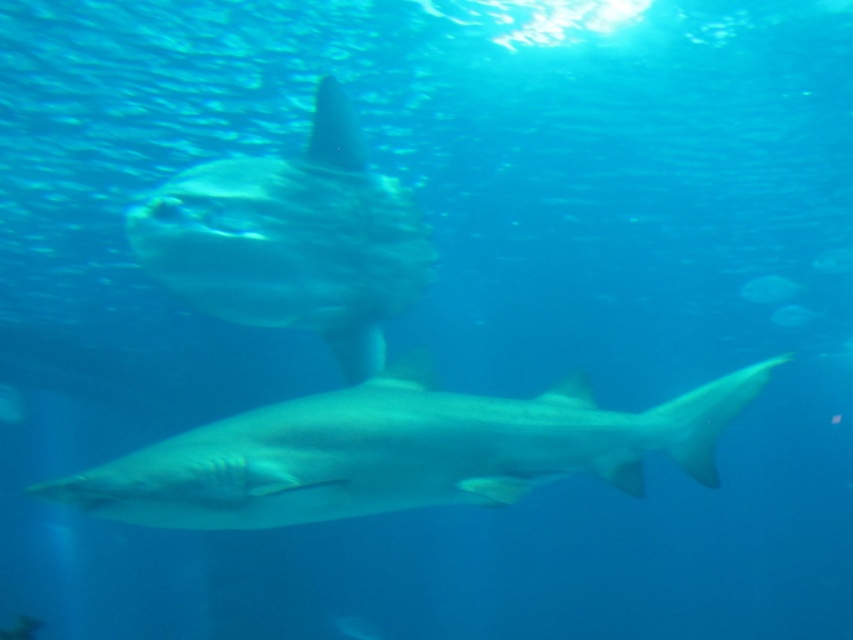
Question: Observing the image, what is the correct spatial positioning of translucent white shark at center in reference to translucent white fish at center?

Choices:
 (A) above
 (B) below

Answer: (A)

Question: Among these points, which one is nearest to the camera?

Choices:
 (A) (790, 298)
 (B) (254, 528)

Answer: (B)

Question: Among these points, which one is nearest to the camera?

Choices:
 (A) (811, 317)
 (B) (747, 289)

Answer: (B)

Question: Which point is closer to the camera taking this photo?

Choices:
 (A) (426, 442)
 (B) (775, 304)

Answer: (A)

Question: Is smooth gray shark at center above translucent white fish at center?

Choices:
 (A) no
 (B) yes

Answer: (A)

Question: Can you confirm if translucent white shark at center is wider than translucent white fish at center?

Choices:
 (A) yes
 (B) no

Answer: (A)